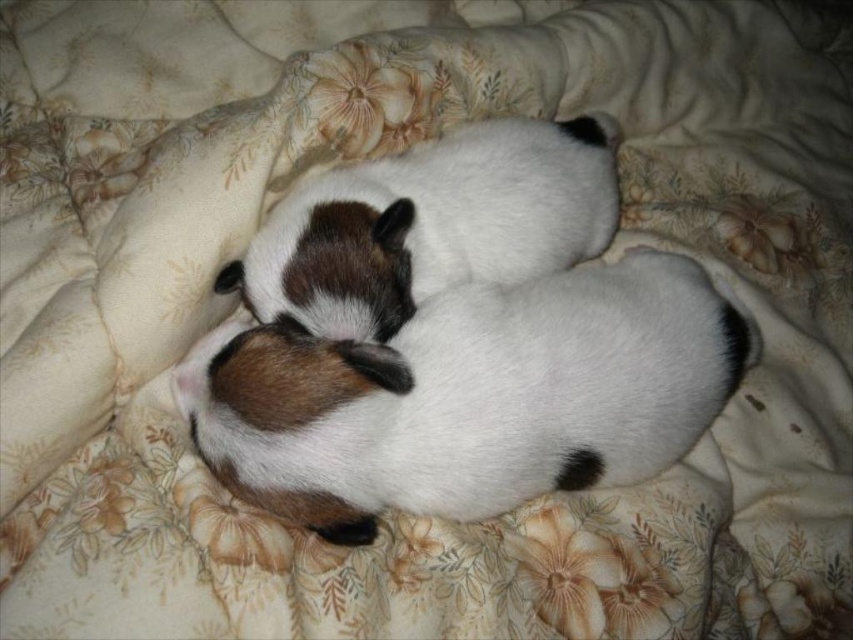
You are standing 5 feet away from the point marked as point (260, 429) in the image. Can you reach the point without moving closer?

The distance of point (260, 429) from viewer is 3.58 feet. Since you are standing 5 feet away, you are farther than the point, so you cannot reach it without moving closer.

You are a photographer trying to capture both puppies in a single frame. Given that your camera has a fixed focus area, can you fit both the white fur dog at center and the white soft fur dog at center into the frame without moving the camera?

The white fur dog at center is wider than the white soft fur dog at center. Since both are at the center, the total width required to include both would depend on their combined widths. However, the description only specifies that the white fur dog is wider, but not the exact dimensions. Without knowing the exact total width needed versus the camera frame size, it is impossible to determine if they can both fit without additional information.

You are a photographer taking a picture of two puppies on a blanket. You need to ensure both are visible in the frame. The white fur dog at center and the white soft fur dog at center are positioned in a way that one is covering part of the other. Which puppy should you adjust to make sure both are fully visible?

The white fur dog at center is below the white soft fur dog at center. To ensure both are fully visible, you should adjust the white fur dog at center to move it out from under the white soft fur dog at center.